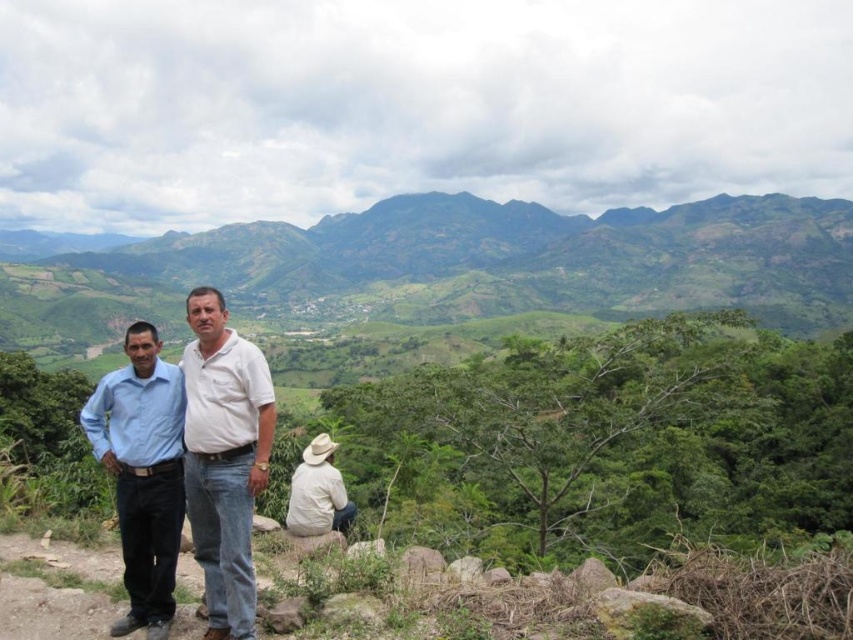
Question: Which object is positioned closest to the matte blue shirt at center?

Choices:
 (A) green leafy mountain at upper center
 (B) blue cotton shirt at left

Answer: (B)

Question: Does blue cotton shirt at left have a larger size compared to khaki fabric hat at lower center?

Choices:
 (A) yes
 (B) no

Answer: (A)

Question: In this image, where is matte blue shirt at center located relative to blue cotton shirt at left?

Choices:
 (A) above
 (B) below

Answer: (A)

Question: Which point is closer to the camera?

Choices:
 (A) (120, 480)
 (B) (421, 250)

Answer: (A)

Question: Can you confirm if green leafy mountain at upper center is positioned above khaki fabric hat at lower center?

Choices:
 (A) yes
 (B) no

Answer: (A)

Question: Which point is closer to the camera taking this photo?

Choices:
 (A) (468, 273)
 (B) (209, 385)

Answer: (B)